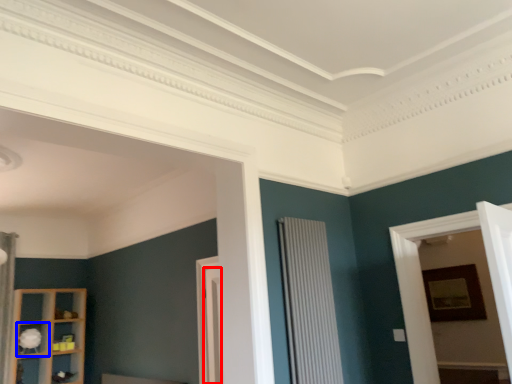
Question: Which point is further to the camera, door (highlighted by a red box) or shelf (highlighted by a blue box)?

Choices:
 (A) door
 (B) shelf

Answer: (B)